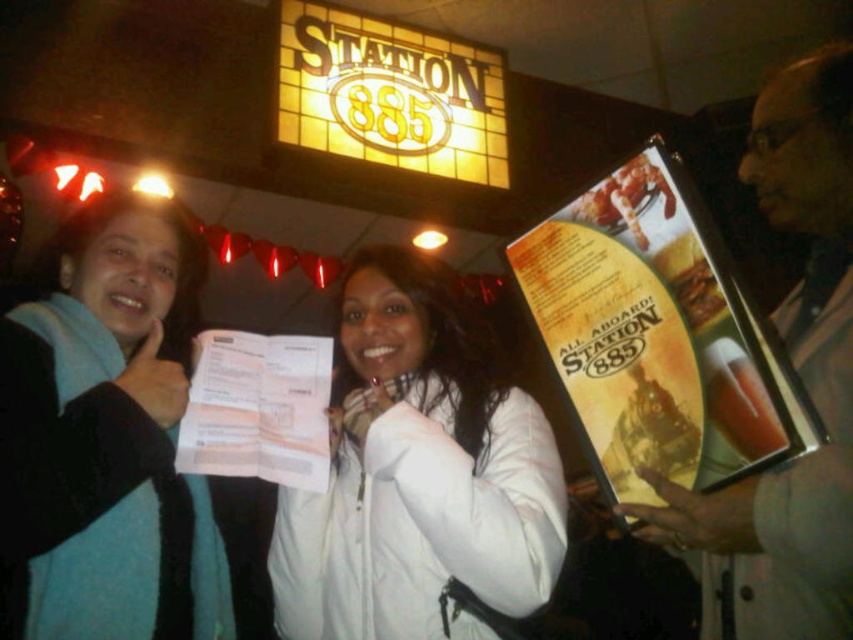
In the scene shown: You are at a restaurant named Station 885 and see a white matte jacket at center and a teal sweater at left. Which one is positioned to the right of the other?

The white matte jacket at center is positioned to the right of the teal sweater at left.